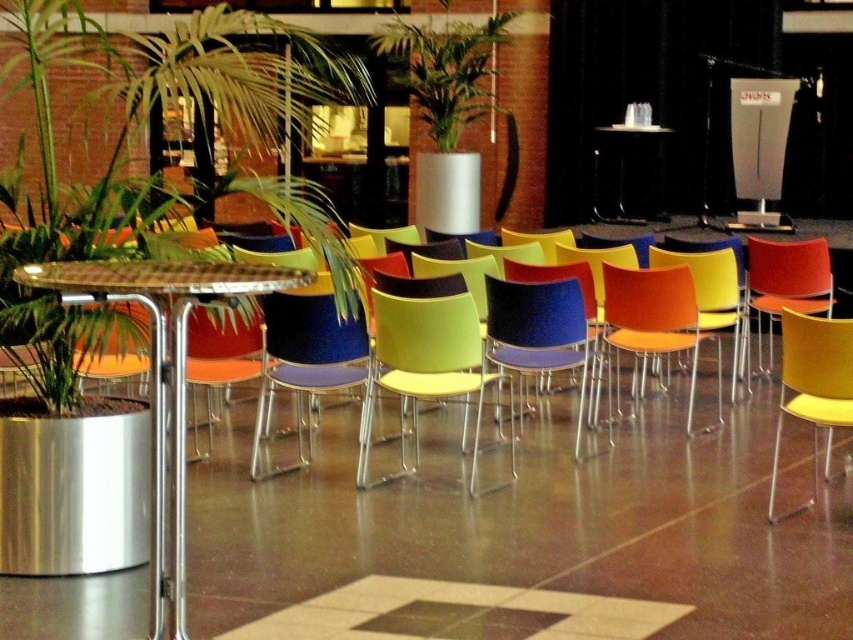
You are standing in the lounge and want to move from the green leafy plant at upper center to the orange plastic swivel chair at center. Which direction should you move to get closer to the chair?

You should move backward because the green leafy plant at upper center is closer to you than the orange plastic swivel chair at center, so moving backward would bring you closer to the chair.

You are sitting in the lounge and want to move to the door located behind the matte plastic chair at right. Can you walk directly to the door without moving around the green leafy plant at upper center?

The matte plastic chair at right is behind the green leafy plant at upper center, so you would need to move around the green leafy plant at upper center to reach the door behind the matte plastic chair at right.